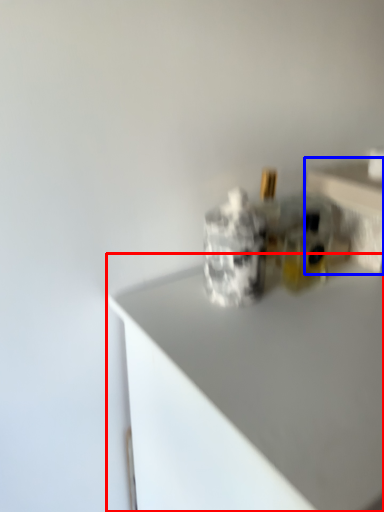
Question: Which of the following is the closest to the observer, countertop (highlighted by a red box) or table (highlighted by a blue box)?

Choices:
 (A) countertop
 (B) table

Answer: (A)